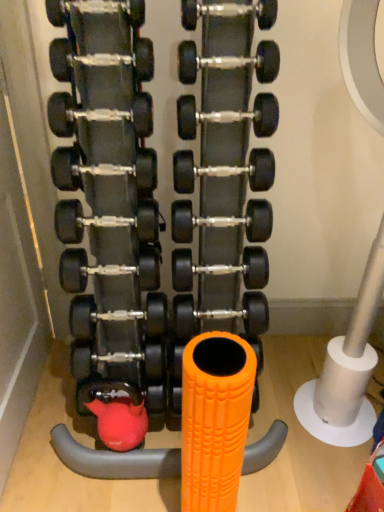
Question: Is black rubber dumbbell at center, acting as the 4th dumbbell starting from the bottom, located within matte black dumbbell at upper center, the fourteenth dumbbell positioned from the bottom?

Choices:
 (A) no
 (B) yes

Answer: (A)

Question: From the image's perspective, is matte black dumbbell at upper center, which ranks as the 2th dumbbell in top-to-bottom order, located beneath black rubber dumbbell at center, acting as the 4th dumbbell starting from the bottom?

Choices:
 (A) no
 (B) yes

Answer: (A)

Question: Is matte black dumbbell at upper center, which ranks as the 2th dumbbell in top-to-bottom order, shorter than black rubber dumbbell at center, the twelfth dumbbell positioned from the top?

Choices:
 (A) yes
 (B) no

Answer: (A)

Question: Can you confirm if matte black dumbbell at upper center, which ranks as the 2th dumbbell in top-to-bottom order, is bigger than black rubber dumbbell at center, the twelfth dumbbell positioned from the top?

Choices:
 (A) yes
 (B) no

Answer: (B)

Question: Does matte black dumbbell at upper center, the fourteenth dumbbell positioned from the bottom, come in front of black rubber dumbbell at center, acting as the 4th dumbbell starting from the bottom?

Choices:
 (A) yes
 (B) no

Answer: (A)

Question: Considering the relative sizes of matte black dumbbell at upper center, the fourteenth dumbbell positioned from the bottom, and black rubber dumbbell at center, acting as the 4th dumbbell starting from the bottom, in the image provided, is matte black dumbbell at upper center, the fourteenth dumbbell positioned from the bottom, taller than black rubber dumbbell at center, acting as the 4th dumbbell starting from the bottom,?

Choices:
 (A) yes
 (B) no

Answer: (B)

Question: Is matte black dumbbell at upper center, the fourteenth dumbbell positioned from the bottom, in contact with black rubber dumbbell at center, the eighth dumbbell in the bottom-to-top sequence?

Choices:
 (A) no
 (B) yes

Answer: (A)

Question: From a real-world perspective, does matte black dumbbell at upper center, the fourteenth dumbbell positioned from the bottom, stand above black rubber dumbbell at center, which is the 8th dumbbell from top to bottom?

Choices:
 (A) yes
 (B) no

Answer: (A)

Question: Is matte black dumbbell at upper center, the fourteenth dumbbell positioned from the bottom, not inside black rubber dumbbell at center, which is the 8th dumbbell from top to bottom?

Choices:
 (A) no
 (B) yes

Answer: (B)

Question: Is matte black dumbbell at upper center, the fourteenth dumbbell positioned from the bottom, oriented away from black rubber dumbbell at center, which is the 8th dumbbell from top to bottom?

Choices:
 (A) no
 (B) yes

Answer: (A)

Question: Is matte black dumbbell at upper center, the fourteenth dumbbell positioned from the bottom, positioned in front of black rubber dumbbell at center, the eighth dumbbell in the bottom-to-top sequence?

Choices:
 (A) yes
 (B) no

Answer: (A)

Question: Could you tell me if matte black dumbbell at upper center, which ranks as the 2th dumbbell in top-to-bottom order, is turned towards black rubber dumbbell at center, which is the 8th dumbbell from top to bottom?

Choices:
 (A) yes
 (B) no

Answer: (B)

Question: Can you confirm if black rubber dumbbell at center, which is the 5th dumbbell in bottom-to-top order, is positioned to the left of black rubber dumbbell at center, the twelfth dumbbell positioned from the top?

Choices:
 (A) no
 (B) yes

Answer: (A)